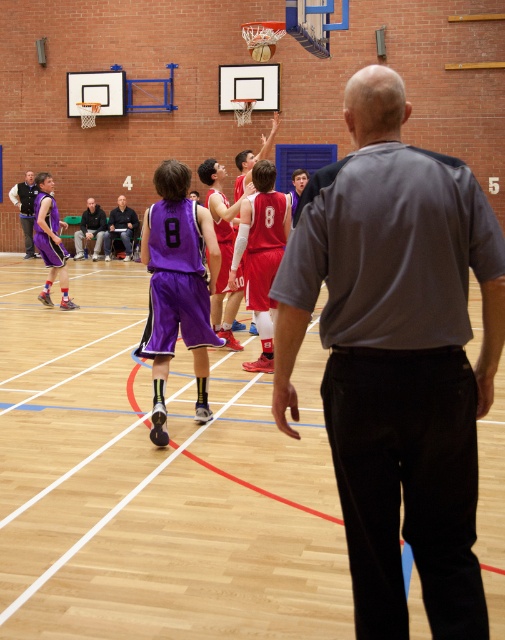
You are a basketball player standing at the point with coordinates (156, 483). Where are you currently standing on the court?

The point at coordinates (156, 483) indicates the wooden floor at center, so you are standing at the center of the court.

You are a spectator at the basketball game and notice the gray smooth shirt at center and the dark gray pants at center. Which one has a greater height in the image?

The gray smooth shirt at center is taller than the dark gray pants at center according to the description.

You are a spectator standing at the back of the gymnasium. You notice the wooden floor at center and the dark gray pants at center. From your vantage point, which object is located to the right of the other?

The wooden floor at center is positioned on the right side of dark gray pants at center, so from your vantage point, the wooden floor at center is to the right of the dark gray pants at center.